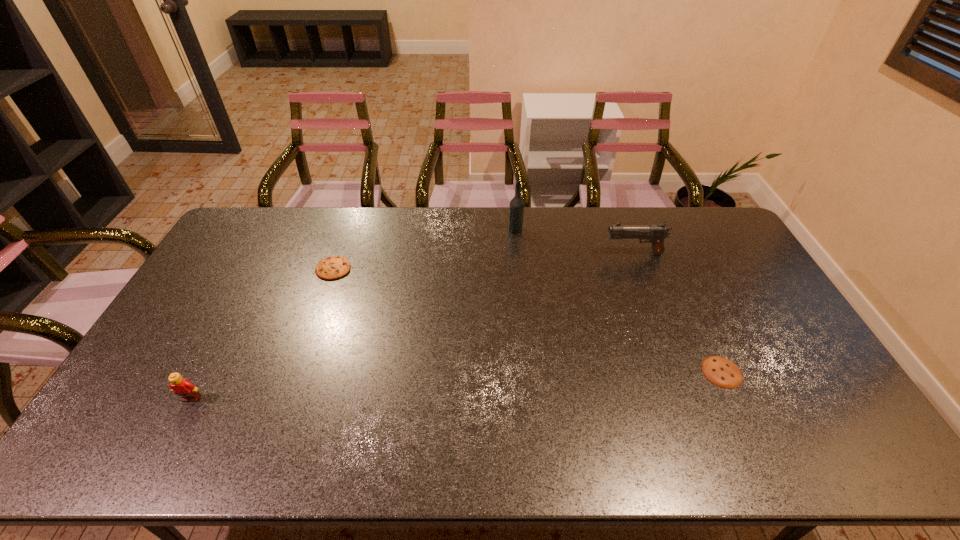
Find the location of `vacant area situated 0.240m on the front of the tallest object`. vacant area situated 0.240m on the front of the tallest object is located at coordinates coord(519,278).

At what (x,y) coordinates should I click in order to perform the action: click on blank space located in the direction the fourth nearest object is aimed. Please return your answer as a coordinate pair (x, y). The height and width of the screenshot is (540, 960). Looking at the image, I should click on (533, 253).

Identify the location of vacant space located 0.220m in the direction the fourth nearest object is aimed. (541, 253).

You are a GUI agent. You are given a task and a screenshot of the screen. Output one action in this format:
    pyautogui.click(x=<x>, y=<y>)
    Task: Click on the free spot located in the direction the fourth nearest object is aimed
    
    Given the screenshot: What is the action you would take?
    pyautogui.click(x=525, y=253)

Where is `vacant space located on the face of the nearest object`? vacant space located on the face of the nearest object is located at coordinates (159, 460).

Locate an element on the screen. The height and width of the screenshot is (540, 960). free location located 0.300m on the left of the second object from left to right is located at coordinates (228, 269).

This screenshot has width=960, height=540. In order to click on free point located on the back of the nearer cookie in this screenshot , I will do point(677,274).

This screenshot has height=540, width=960. Find the location of `object that is at the far edge`. object that is at the far edge is located at coordinates (516, 208).

At what (x,y) coordinates should I click in order to perform the action: click on object that is positioned at the left edge. Please return your answer as a coordinate pair (x, y). The image size is (960, 540). Looking at the image, I should click on (182, 387).

The image size is (960, 540). Identify the location of vacant region at the far edge of the desktop. pos(546,234).